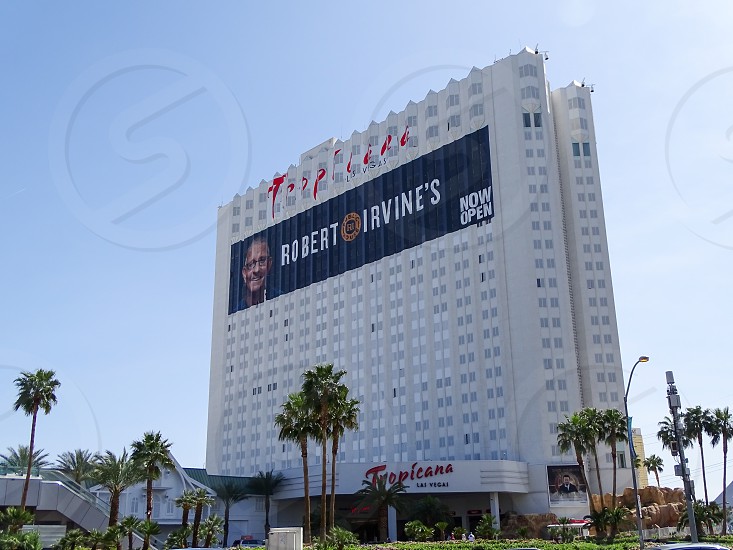
Identify the location of support pillars. Image resolution: width=733 pixels, height=550 pixels. (496, 506), (393, 521).